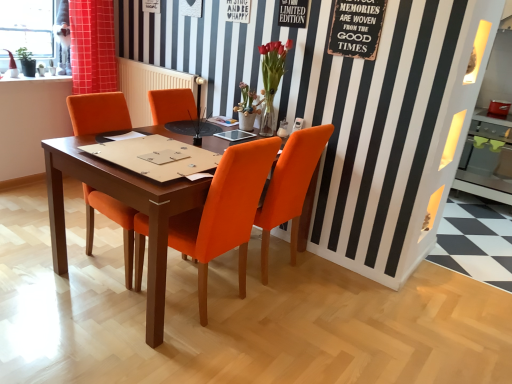
What are the coordinates of `vacant space in front of orange fabric chair at center, the first chair from the right` in the screenshot? It's located at [x=284, y=323].